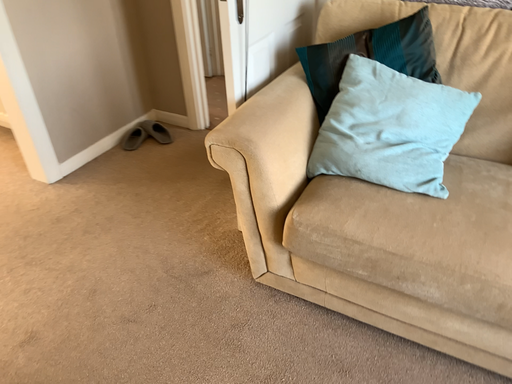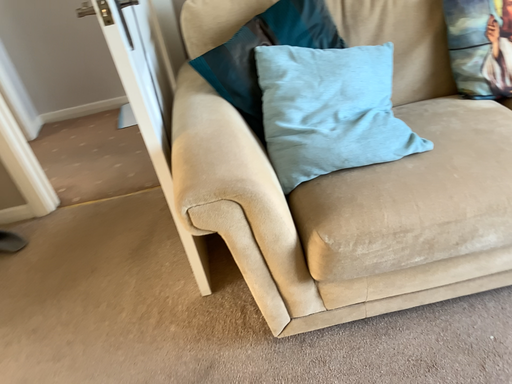
Question: Which way did the camera rotate in the video?

Choices:
 (A) rotated upward
 (B) rotated downward

Answer: (A)